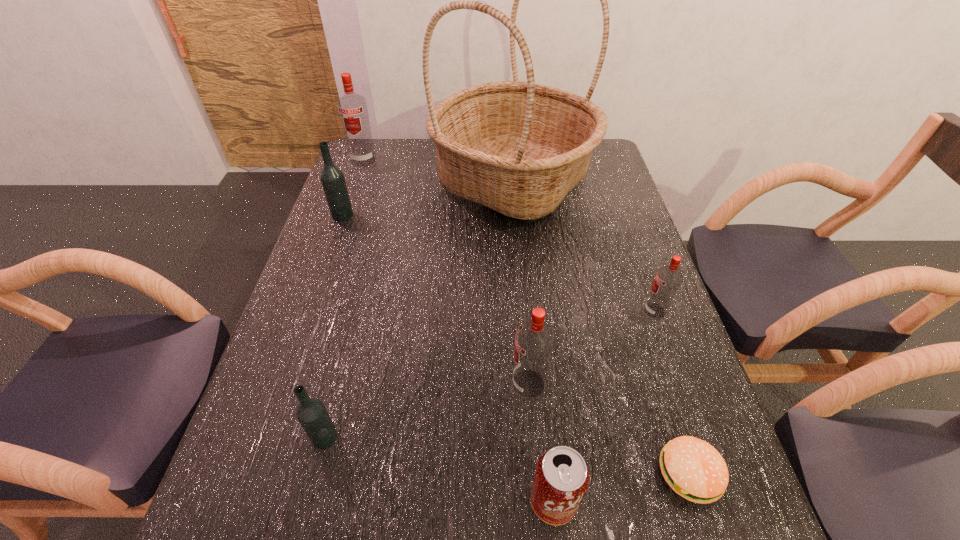
Select which object appears as the third closest to the seventh tallest object. Please provide its 2D coordinates. Your answer should be formatted as a tuple, i.e. [(x, y)], where the tuple contains the x and y coordinates of a point satisfying the conditions above.

[(311, 413)]

Identify which vodka is located as the fourth nearest to the third nearest vodka. Please provide its 2D coordinates. Your answer should be formatted as a tuple, i.e. [(x, y)], where the tuple contains the x and y coordinates of a point satisfying the conditions above.

[(352, 108)]

This screenshot has width=960, height=540. I want to click on vodka that stands as the closest to the nearer black vodka, so click(x=534, y=340).

Locate which red vodka is the third closest to the tallest object. Please provide its 2D coordinates. Your answer should be formatted as a tuple, i.e. [(x, y)], where the tuple contains the x and y coordinates of a point satisfying the conditions above.

[(534, 340)]

In order to click on the second closest red vodka relative to the brown patty in this screenshot , I will do `click(668, 278)`.

You are a GUI agent. You are given a task and a screenshot of the screen. Output one action in this format:
    pyautogui.click(x=<x>, y=<y>)
    Task: Click on the free space that satisfies the following two spatial constraints: 1. on the front label of the second vodka from right to left; 2. on the right side of the red soda can
    
    Given the screenshot: What is the action you would take?
    pyautogui.click(x=539, y=501)

Find the location of a particular element. The width and height of the screenshot is (960, 540). vacant space that satisfies the following two spatial constraints: 1. on the front label of the second shortest object; 2. on the right side of the second nearest vodka is located at coordinates (539, 501).

You are a GUI agent. You are given a task and a screenshot of the screen. Output one action in this format:
    pyautogui.click(x=<x>, y=<y>)
    Task: Click on the free space that satisfies the following two spatial constraints: 1. on the front label of the tallest vodka; 2. on the right side of the basket
    
    Given the screenshot: What is the action you would take?
    pyautogui.click(x=356, y=181)

Identify the location of vacant area in the image that satisfies the following two spatial constraints: 1. on the front label of the biggest red vodka; 2. on the left side of the shortest object. The image size is (960, 540). (256, 474).

Find the location of a particular element. blank area in the image that satisfies the following two spatial constraints: 1. on the front label of the fifth farthest object; 2. on the back side of the shortest object is located at coordinates (537, 474).